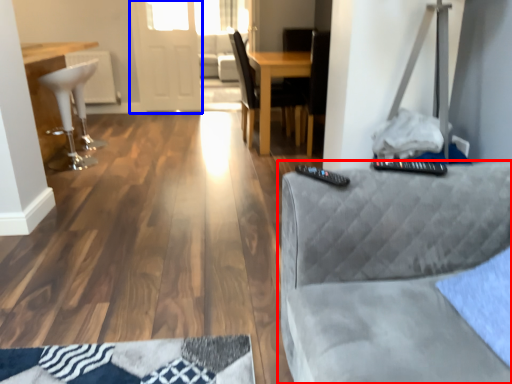
Question: Which point is further to the camera, studio couch (highlighted by a red box) or glass door (highlighted by a blue box)?

Choices:
 (A) studio couch
 (B) glass door

Answer: (B)